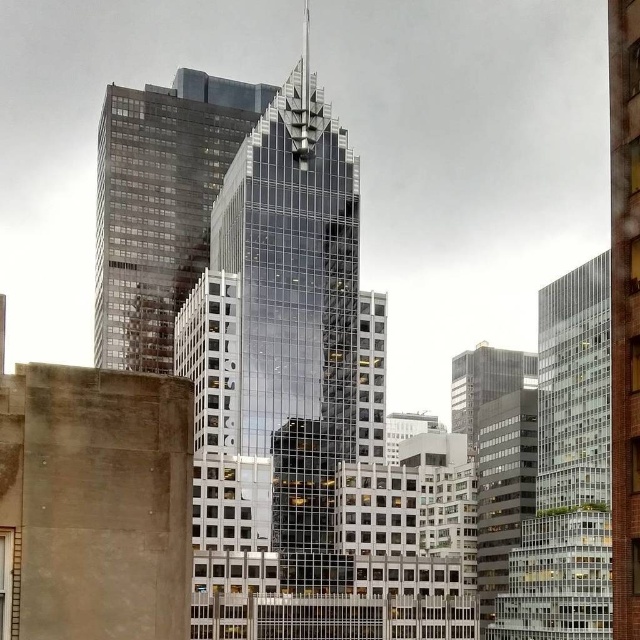
Who is lower down, glassy reflective building at right or matte glass skyscraper at center?

Positioned lower is glassy reflective building at right.

Can you confirm if glassy reflective building at right is wider than matte glass skyscraper at center?

In fact, glassy reflective building at right might be narrower than matte glass skyscraper at center.

Is point (580, 508) less distant than point (476, 403)?

Yes.

Identify the location of glassy reflective building at right. This screenshot has height=640, width=640. (566, 472).

Is glassy reflective skyscraper at center shorter than glassy steel skyscraper at center?

No, glassy reflective skyscraper at center is not shorter than glassy steel skyscraper at center.

Does glassy reflective skyscraper at center appear on the left side of glassy steel skyscraper at center?

In fact, glassy reflective skyscraper at center is to the right of glassy steel skyscraper at center.

Who is more forward, (282, 154) or (186, 90)?

Positioned in front is point (282, 154).

This screenshot has height=640, width=640. I want to click on glassy reflective skyscraper at center, so click(x=276, y=358).

Between point (177, 284) and point (604, 627), which one is positioned in front?

Positioned in front is point (604, 627).

Does point (216, 177) lie in front of point (593, 396)?

No, (216, 177) is further to viewer.

The height and width of the screenshot is (640, 640). I want to click on glassy steel skyscraper at center, so click(160, 205).